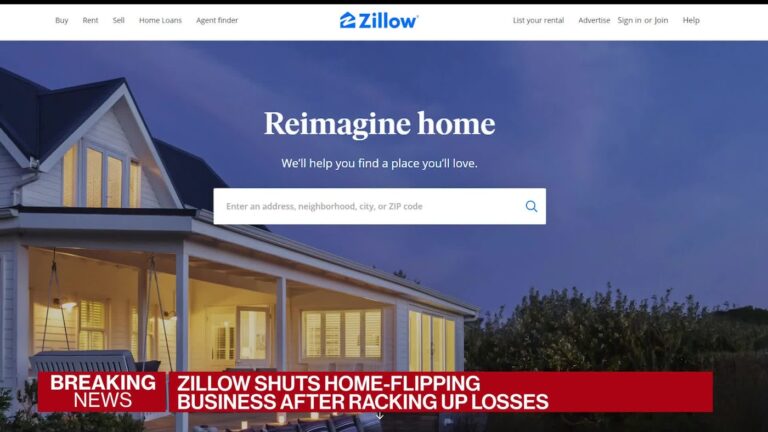
Where is `vertical windows`? The height and width of the screenshot is (432, 768). vertical windows is located at coordinates (425, 342), (412, 339), (437, 341), (449, 343).